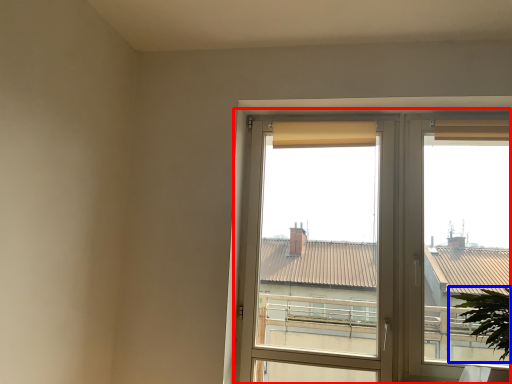
Question: Among these objects, which one is farthest to the camera, window (highlighted by a red box) or houseplant (highlighted by a blue box)?

Choices:
 (A) window
 (B) houseplant

Answer: (A)